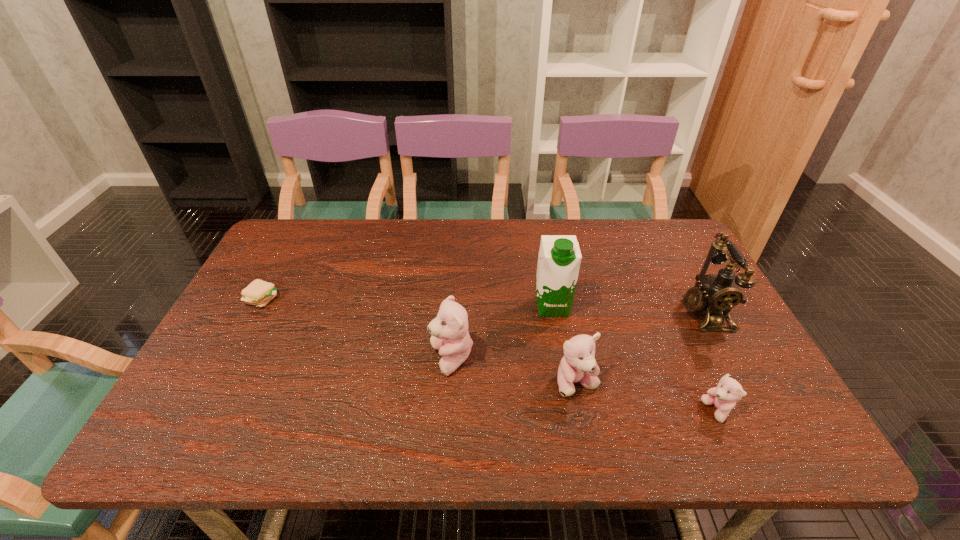
I want to click on blank region between the telephone and the second tallest teddy bear, so click(640, 348).

The height and width of the screenshot is (540, 960). What are the coordinates of `free space between the shortest teddy bear and the soya milk` in the screenshot? It's located at (635, 359).

Identify the location of vacant area between the telephone and the leftmost object. (484, 306).

Locate an element on the screen. Image resolution: width=960 pixels, height=540 pixels. free space that is in between the second shortest teddy bear and the shortest object is located at coordinates (420, 341).

Identify the location of empty space between the rightmost teddy bear and the telephone. The height and width of the screenshot is (540, 960). (710, 362).

The height and width of the screenshot is (540, 960). Find the location of `free spot between the second teddy bear from left to right and the leftmost teddy bear`. free spot between the second teddy bear from left to right and the leftmost teddy bear is located at coordinates (515, 372).

Choose which object is the nearest neighbor to the second object from left to right. Please provide its 2D coordinates. Your answer should be formatted as a tuple, i.e. [(x, y)], where the tuple contains the x and y coordinates of a point satisfying the conditions above.

[(559, 258)]

Where is `object that is the third closest to the patty`? This screenshot has width=960, height=540. object that is the third closest to the patty is located at coordinates (578, 365).

At what (x,y) coordinates should I click in order to perform the action: click on teddy bear that is the second closest to the shortest teddy bear. Please return your answer as a coordinate pair (x, y). Looking at the image, I should click on (449, 330).

Identify which teddy bear is the third nearest to the leftmost object. Please provide its 2D coordinates. Your answer should be formatted as a tuple, i.e. [(x, y)], where the tuple contains the x and y coordinates of a point satisfying the conditions above.

[(728, 391)]